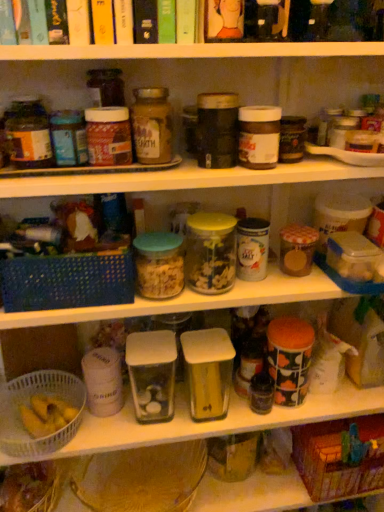
You are a GUI agent. You are given a task and a screenshot of the screen. Output one action in this format:
    pyautogui.click(x=<x>, y=<y>)
    Task: Click on the white plastic basket at lower left, acting as the 2th basket starting from the bottom
    This screenshot has height=512, width=384.
    Given the screenshot: What is the action you would take?
    pyautogui.click(x=27, y=402)

What do you see at coordinates (340, 457) in the screenshot?
I see `brown woven basket at lower right, which is the 3th basket from left to right` at bounding box center [340, 457].

The width and height of the screenshot is (384, 512). I want to click on blue woven basket at left, which ranks as the 3th basket in bottom-to-top order, so click(x=67, y=281).

Identify the location of white plastic basket at lower left, the 2th basket from the top. (27, 402).

Are translucent plastic bag at lower left and matte glass jar at center, arranged as the 2th bottle when viewed from the left, far apart?

They are positioned close to each other.

Looking at the image, does translucent plastic bag at lower left seem bigger or smaller compared to matte glass jar at center, marked as the first bottle in a right-to-left arrangement?

Considering their sizes, translucent plastic bag at lower left takes up more space than matte glass jar at center, marked as the first bottle in a right-to-left arrangement.

This screenshot has height=512, width=384. In order to click on bottle that is the 1st object located in front of the translucent plastic bag at lower left in this screenshot , I will do `click(152, 125)`.

Considering the sizes of objects translucent plastic bag at lower left and matte glass jar at center, arranged as the 2th bottle when viewed from the left, in the image provided, who is shorter, translucent plastic bag at lower left or matte glass jar at center, arranged as the 2th bottle when viewed from the left,?

With less height is translucent plastic bag at lower left.

In the scene shown: Is matte brown jar at upper left, which ranks as the second bottle in right-to-left order, at the back of translucent plastic bag at lower left?

translucent plastic bag at lower left is not turned away from matte brown jar at upper left, which ranks as the second bottle in right-to-left order.

Is translucent plastic bag at lower left in contact with matte brown jar at upper left, the first bottle from the left?

They are not placed beside each other.

Is translucent plastic bag at lower left closer to the viewer compared to matte brown jar at upper left, the first bottle from the left?

That is False.

Considering the sizes of translucent glass jar at center and white plastic basket at lower left, acting as the 2th basket starting from the bottom, in the image, is translucent glass jar at center wider or thinner than white plastic basket at lower left, acting as the 2th basket starting from the bottom,?

In the image, translucent glass jar at center appears to be more narrow than white plastic basket at lower left, acting as the 2th basket starting from the bottom.

How far apart are translucent glass jar at center and white plastic basket at lower left, the 2th basket from the top?

19.81 inches.

Is translucent glass jar at center behind white plastic basket at lower left, which is the first basket from left to right?

No, it is not.

Can we say translucent glass jar at center lies outside white plastic basket at lower left, which is the first basket from left to right?

Yes, translucent glass jar at center is outside of white plastic basket at lower left, which is the first basket from left to right.

Considering the positions of objects white plastic basket at lower left, the 3th basket in the right-to-left sequence, and translucent plastic bag at lower left in the image provided, who is more to the right, white plastic basket at lower left, the 3th basket in the right-to-left sequence, or translucent plastic bag at lower left?

white plastic basket at lower left, the 3th basket in the right-to-left sequence.

How distant is white plastic basket at lower left, acting as the 2th basket starting from the bottom, from translucent plastic bag at lower left?

A distance of 8.37 inches exists between white plastic basket at lower left, acting as the 2th basket starting from the bottom, and translucent plastic bag at lower left.

Is white plastic basket at lower left, acting as the 2th basket starting from the bottom, wider than translucent plastic bag at lower left?

Yes, white plastic basket at lower left, acting as the 2th basket starting from the bottom, is wider than translucent plastic bag at lower left.

Is white plastic basket at lower left, the 2th basket from the top, placed right next to translucent plastic bag at lower left?

No.

Does white plastic basket at lower left, the 2th basket from the top, lie behind brown woven basket at lower right, the third basket from the top?

No, it is not.

Does point (0, 402) appear closer or farther from the camera than point (320, 481)?

Point (0, 402) is positioned closer to the camera compared to point (320, 481).

Is white plastic basket at lower left, acting as the 2th basket starting from the bottom, with brown woven basket at lower right, the 1th basket when ordered from right to left?

white plastic basket at lower left, acting as the 2th basket starting from the bottom, and brown woven basket at lower right, the 1th basket when ordered from right to left, are clearly separated.

Could you measure the distance between white plastic basket at lower left, the 2th basket from the top, and brown woven basket at lower right, which is the 3th basket from left to right?

white plastic basket at lower left, the 2th basket from the top, is 26.91 inches away from brown woven basket at lower right, which is the 3th basket from left to right.

Is point (45, 124) less distant than point (208, 265)?

Yes, point (45, 124) is closer to viewer.

From the image's perspective, is matte brown jar at upper left, which ranks as the second bottle in right-to-left order, on translucent glass jar at center?

Correct, matte brown jar at upper left, which ranks as the second bottle in right-to-left order, appears higher than translucent glass jar at center in the image.

Find the location of `glass jar that appears below the matte brown jar at upper left, the first bottle from the left (from the image's perspective)`. glass jar that appears below the matte brown jar at upper left, the first bottle from the left (from the image's perspective) is located at coordinates (210, 252).

Consider the image. Considering the relative sizes of matte glass jar at center, arranged as the 2th bottle when viewed from the left, and white plastic basket at lower left, the 3th basket in the right-to-left sequence, in the image provided, is matte glass jar at center, arranged as the 2th bottle when viewed from the left, smaller than white plastic basket at lower left, the 3th basket in the right-to-left sequence,?

Indeed, matte glass jar at center, arranged as the 2th bottle when viewed from the left, has a smaller size compared to white plastic basket at lower left, the 3th basket in the right-to-left sequence.

From the picture: From a real-world perspective, which is physically below, matte glass jar at center, marked as the first bottle in a right-to-left arrangement, or white plastic basket at lower left, the 2th basket from the top?

In real-world perspective, white plastic basket at lower left, the 2th basket from the top, is lower.

Would you say matte glass jar at center, marked as the first bottle in a right-to-left arrangement, contains white plastic basket at lower left, which is the first basket from left to right?

No, white plastic basket at lower left, which is the first basket from left to right, is not inside matte glass jar at center, marked as the first bottle in a right-to-left arrangement.

From the picture: In terms of width, does matte glass jar at center, marked as the first bottle in a right-to-left arrangement, look wider or thinner when compared to white plastic basket at lower left, the 3th basket in the right-to-left sequence?

Clearly, matte glass jar at center, marked as the first bottle in a right-to-left arrangement, has less width compared to white plastic basket at lower left, the 3th basket in the right-to-left sequence.

Locate an element on the screen. The image size is (384, 512). food below the matte glass jar at center, arranged as the 2th bottle when viewed from the left (from a real-world perspective) is located at coordinates (28, 488).

At what (x,y) coordinates should I click in order to perform the action: click on the 1st bottle above when counting from the translucent plastic bag at lower left (from the image's perspective). Please return your answer as a coordinate pair (x, y). The height and width of the screenshot is (512, 384). Looking at the image, I should click on (x=28, y=134).

Which object lies nearer to the anchor point brown woven basket at lower right, the 1th basket when ordered from right to left, white plastic basket at lower left, the 3th basket in the right-to-left sequence, or matte glass jar at center, marked as the first bottle in a right-to-left arrangement?

Based on the image, white plastic basket at lower left, the 3th basket in the right-to-left sequence, appears to be nearer to brown woven basket at lower right, the 1th basket when ordered from right to left.

In the scene shown: Based on their spatial positions, is matte glass jar at center, arranged as the 2th bottle when viewed from the left, or translucent plastic bag at lower left further from brown woven basket at lower right, the third basket from the top?

The object further to brown woven basket at lower right, the third basket from the top, is matte glass jar at center, arranged as the 2th bottle when viewed from the left.

Estimate the real-world distances between objects in this image. Which object is closer to brown woven basket at lower right, which is the 3th basket from left to right, translucent glass jar at center or translucent plastic bag at lower left?

translucent glass jar at center is closer to brown woven basket at lower right, which is the 3th basket from left to right.

Which object lies nearer to the anchor point translucent glass jar at center, matte brown jar at upper left, which ranks as the second bottle in right-to-left order, or blue woven basket at left, acting as the first basket starting from the top?

blue woven basket at left, acting as the first basket starting from the top.

Looking at the image, which one is located closer to blue woven basket at left, which is the 2th basket from right to left, translucent glass jar at center or translucent plastic bag at lower left?

translucent glass jar at center is closer to blue woven basket at left, which is the 2th basket from right to left.

Based on their spatial positions, is brown woven basket at lower right, which is the 3th basket from left to right, or matte brown jar at upper left, which ranks as the second bottle in right-to-left order, closer to white plastic basket at lower left, which is the first basket from left to right?

Based on the image, matte brown jar at upper left, which ranks as the second bottle in right-to-left order, appears to be nearer to white plastic basket at lower left, which is the first basket from left to right.

Looking at the image, which one is located further to blue woven basket at left, which is the 2th basket from right to left, translucent plastic bag at lower left or translucent glass jar at center?

Based on the image, translucent plastic bag at lower left appears to be further to blue woven basket at left, which is the 2th basket from right to left.

Estimate the real-world distances between objects in this image. Which object is closer to translucent glass jar at center, blue woven basket at left, which ranks as the 3th basket in bottom-to-top order, or brown woven basket at lower right, which is the 3th basket from left to right?

The object closer to translucent glass jar at center is blue woven basket at left, which ranks as the 3th basket in bottom-to-top order.

What are the coordinates of `bottle between matte glass jar at center, arranged as the 2th bottle when viewed from the left, and white plastic basket at lower left, acting as the 2th basket starting from the bottom, vertically` in the screenshot? It's located at (28, 134).

Find the location of a particular element. Image resolution: width=384 pixels, height=512 pixels. glass jar between blue woven basket at left, which ranks as the 2th basket in left-to-right order, and brown woven basket at lower right, the third basket from the top, in the horizontal direction is located at coordinates (210, 252).

The width and height of the screenshot is (384, 512). Find the location of `basket located between white plastic basket at lower left, the 3th basket in the right-to-left sequence, and brown woven basket at lower right, which is the 3th basket from left to right, in the left-right direction`. basket located between white plastic basket at lower left, the 3th basket in the right-to-left sequence, and brown woven basket at lower right, which is the 3th basket from left to right, in the left-right direction is located at coordinates (67, 281).

The width and height of the screenshot is (384, 512). I want to click on glass jar that lies between matte brown jar at upper left, which ranks as the second bottle in right-to-left order, and translucent plastic bag at lower left from top to bottom, so click(210, 252).